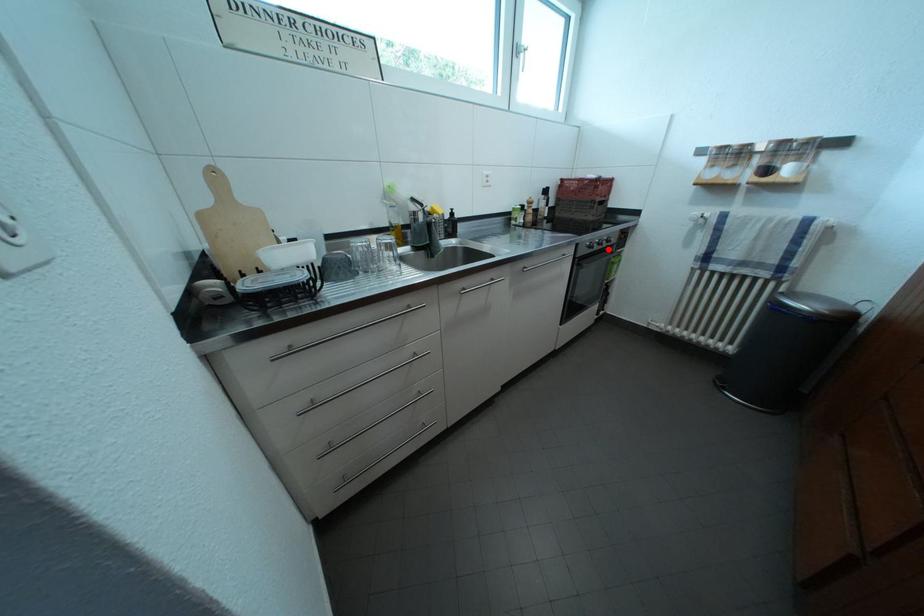
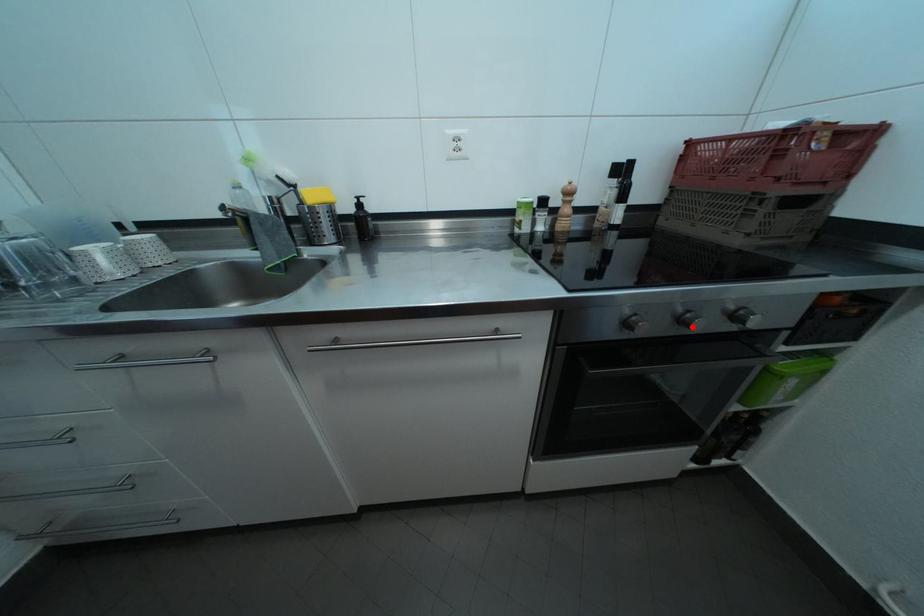
I am providing you with two images of the same scene from different viewpoints. A red point is marked on the first image and another point is marked on the second image. Is the red point in image1 aligned with the point shown in image2?

Yes